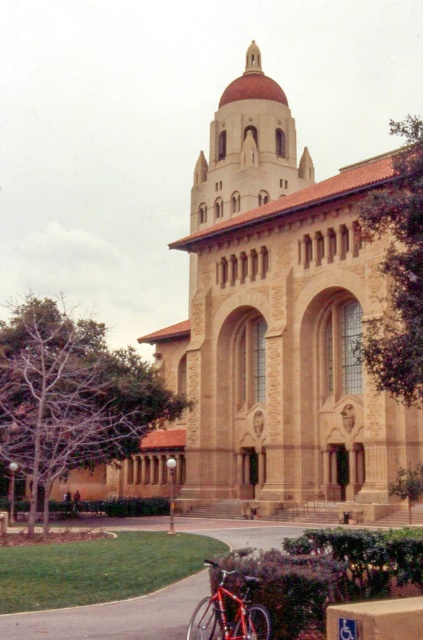
Locate an element on the screen. beige stone church at center is located at coordinates (277, 324).

Consider the image. Does beige stone church at center appear on the left side of cardboard at lower right?

Correct, you'll find beige stone church at center to the left of cardboard at lower right.

Measure the distance between point (343,497) and camera.

Point (343,497) is 52.94 meters away from camera.

Where is `beige stone church at center`? beige stone church at center is located at coordinates (277, 324).

Who is positioned more to the left, beige stone church at center or smooth asphalt pavement at lower center?

smooth asphalt pavement at lower center

Is point (269, 198) positioned after point (95, 634)?

Yes, point (269, 198) is farther from viewer.

Between point (332, 417) and point (282, 536), which one is positioned behind?

The point (332, 417) is behind.

You are a GUI agent. You are given a task and a screenshot of the screen. Output one action in this format:
    pyautogui.click(x=<x>, y=<y>)
    Task: Click on the beige stone church at center
    This screenshot has width=423, height=640.
    Given the screenshot: What is the action you would take?
    (277, 324)

Consider the image. Does smooth asphalt pavement at lower center appear on the left side of shiny red bicycle at lower left?

Result: Yes, smooth asphalt pavement at lower center is to the left of shiny red bicycle at lower left.

Measure the distance between point (239,544) and camera.

Point (239,544) and camera are 41.75 meters apart.

This screenshot has width=423, height=640. Find the location of `smooth asphalt pavement at lower center`. smooth asphalt pavement at lower center is located at coordinates (114, 616).